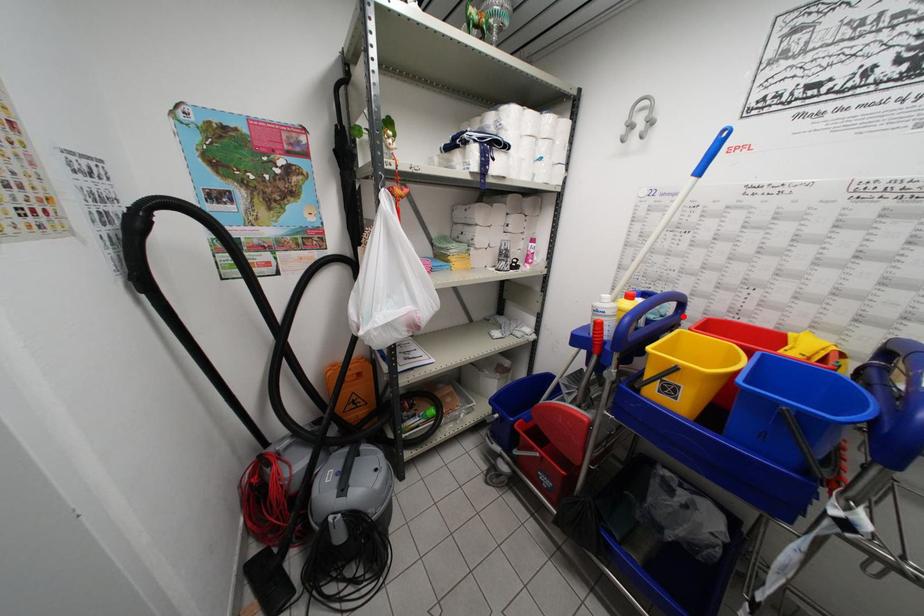
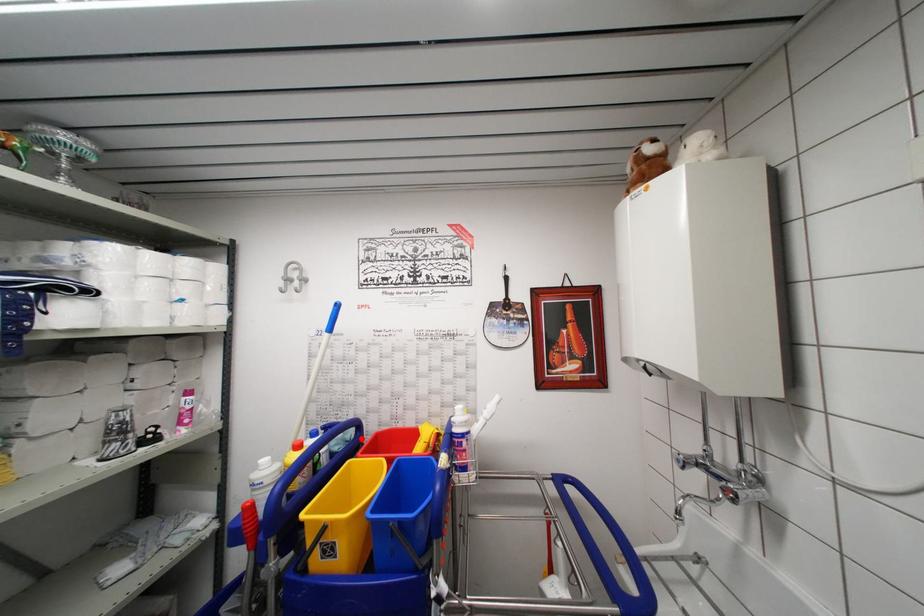
I am providing you with two images of the same scene from different viewpoints. A red point is marked on the first image and another point is marked on the second image. Does the point marked in image1 correspond to the same location as the one in image2?

Yes